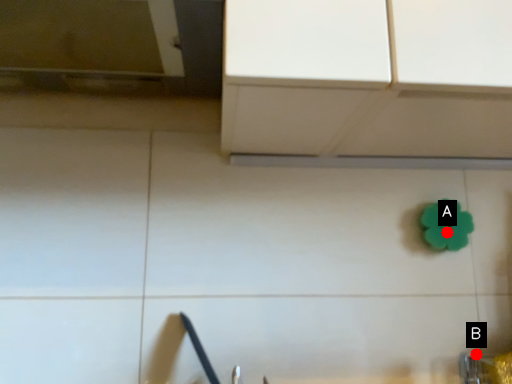
Question: Two points are circled on the image, labeled by A and B beside each circle. Among these points, which one is farthest from the camera?

Choices:
 (A) A is further
 (B) B is further

Answer: (A)